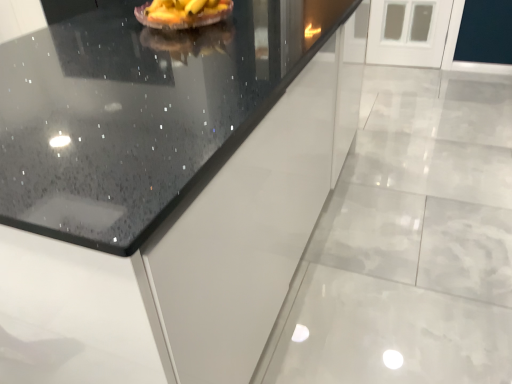
Question: Is yellow matte cake at upper center in front of or behind black granite countertop at center in the image?

Choices:
 (A) front
 (B) behind

Answer: (B)

Question: Considering the positions of yellow matte cake at upper center and black granite countertop at center in the image, is yellow matte cake at upper center wider or thinner than black granite countertop at center?

Choices:
 (A) wide
 (B) thin

Answer: (B)

Question: Considering the positions of yellow matte cake at upper center and black granite countertop at center in the image, is yellow matte cake at upper center taller or shorter than black granite countertop at center?

Choices:
 (A) short
 (B) tall

Answer: (A)

Question: From a real-world perspective, is black granite countertop at center above or below yellow matte cake at upper center?

Choices:
 (A) below
 (B) above

Answer: (A)

Question: From the image's perspective, is black granite countertop at center positioned above or below yellow matte cake at upper center?

Choices:
 (A) above
 (B) below

Answer: (B)

Question: In terms of height, does black granite countertop at center look taller or shorter compared to yellow matte cake at upper center?

Choices:
 (A) tall
 (B) short

Answer: (A)

Question: Visually, is black granite countertop at center positioned to the left or to the right of yellow matte cake at upper center?

Choices:
 (A) left
 (B) right

Answer: (B)